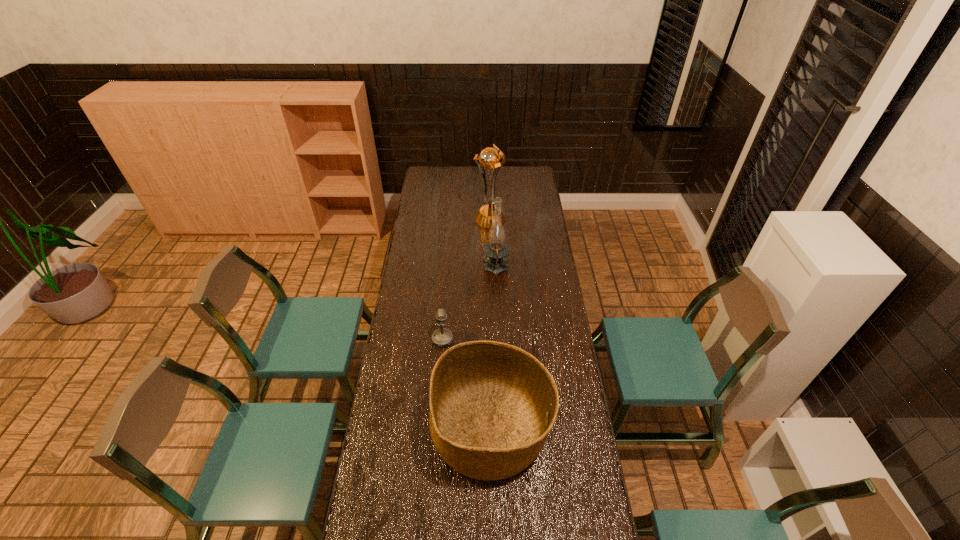
Image resolution: width=960 pixels, height=540 pixels. I want to click on object that is at the right edge, so click(x=492, y=405).

Find the location of `vacant space at the far edge of the desktop`. vacant space at the far edge of the desktop is located at coordinates (467, 178).

You are a GUI agent. You are given a task and a screenshot of the screen. Output one action in this format:
    pyautogui.click(x=<x>, y=<y>)
    Task: Click on the free location at the left edge
    This screenshot has height=540, width=960.
    Given the screenshot: What is the action you would take?
    pyautogui.click(x=427, y=319)

In the image, there is a desktop. At what (x,y) coordinates should I click in order to perform the action: click on free region at the right edge. Please return your answer as a coordinate pair (x, y). Image resolution: width=960 pixels, height=540 pixels. Looking at the image, I should click on (532, 245).

Where is `vacant space at the far left corner`? vacant space at the far left corner is located at coordinates (424, 179).

I want to click on blank region between the shortest object and the trophy, so click(x=467, y=279).

The image size is (960, 540). I want to click on vacant area that lies between the farthest object and the shortest object, so click(467, 279).

Where is `vacant area that lies between the nearest object and the farthest object`? Image resolution: width=960 pixels, height=540 pixels. vacant area that lies between the nearest object and the farthest object is located at coordinates (490, 325).

Where is `empty space that is in between the basket and the farthest object`? empty space that is in between the basket and the farthest object is located at coordinates (490, 325).

Image resolution: width=960 pixels, height=540 pixels. In order to click on free space between the third farthest object and the oil lamp in this screenshot , I will do `click(469, 304)`.